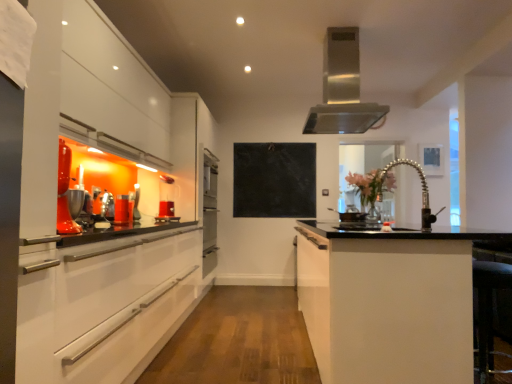
Question: Could you tell me if stainless steel range hood at upper center is facing translucent glass cup at left, arranged as the 2th appliance when viewed from the back?

Choices:
 (A) yes
 (B) no

Answer: (B)

Question: Is stainless steel range hood at upper center outside translucent glass cup at left, the 1th appliance viewed from the left?

Choices:
 (A) no
 (B) yes

Answer: (B)

Question: Considering the relative sizes of stainless steel range hood at upper center and translucent glass cup at left, the 1th appliance viewed from the left, in the image provided, is stainless steel range hood at upper center taller than translucent glass cup at left, the 1th appliance viewed from the left,?

Choices:
 (A) no
 (B) yes

Answer: (B)

Question: Is translucent glass cup at left, arranged as the 2th appliance when viewed from the back, at the back of stainless steel range hood at upper center?

Choices:
 (A) yes
 (B) no

Answer: (B)

Question: Is translucent glass cup at left, arranged as the 2th appliance when viewed from the back, located within stainless steel range hood at upper center?

Choices:
 (A) no
 (B) yes

Answer: (A)

Question: Is stainless steel range hood at upper center at the right side of translucent glass cup at left, arranged as the first appliance when viewed from the front?

Choices:
 (A) yes
 (B) no

Answer: (A)

Question: Is black marble bulletin board at center completely or partially inside black matte stove at center, the 2th appliance viewed from the front?

Choices:
 (A) yes
 (B) no

Answer: (B)

Question: From a real-world perspective, is black matte stove at center, the 2th appliance when ordered from left to right, under black marble bulletin board at center?

Choices:
 (A) no
 (B) yes

Answer: (B)

Question: Does black matte stove at center, the 2th appliance when ordered from left to right, have a greater height compared to black marble bulletin board at center?

Choices:
 (A) yes
 (B) no

Answer: (B)

Question: Is black matte stove at center, the 2th appliance when ordered from left to right, positioned before black marble bulletin board at center?

Choices:
 (A) yes
 (B) no

Answer: (A)

Question: Is black matte stove at center, the 2th appliance viewed from the front, turned away from black marble bulletin board at center?

Choices:
 (A) no
 (B) yes

Answer: (A)

Question: Does black matte stove at center, arranged as the first appliance when viewed from the back, appear on the left side of black marble bulletin board at center?

Choices:
 (A) no
 (B) yes

Answer: (A)

Question: Is the depth of translucent glass vase at center less than that of satin nickel faucet at center?

Choices:
 (A) no
 (B) yes

Answer: (A)